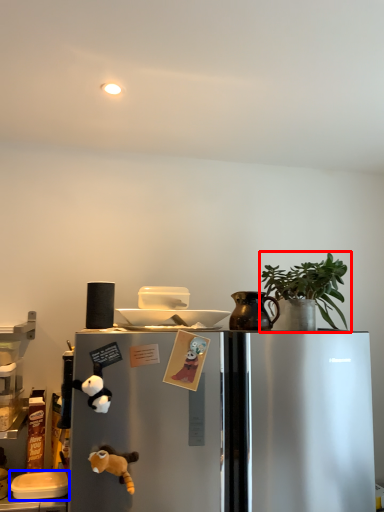
Question: Which object appears farthest to the camera in this image, houseplant (highlighted by a red box) or appliance (highlighted by a blue box)?

Choices:
 (A) houseplant
 (B) appliance

Answer: (B)